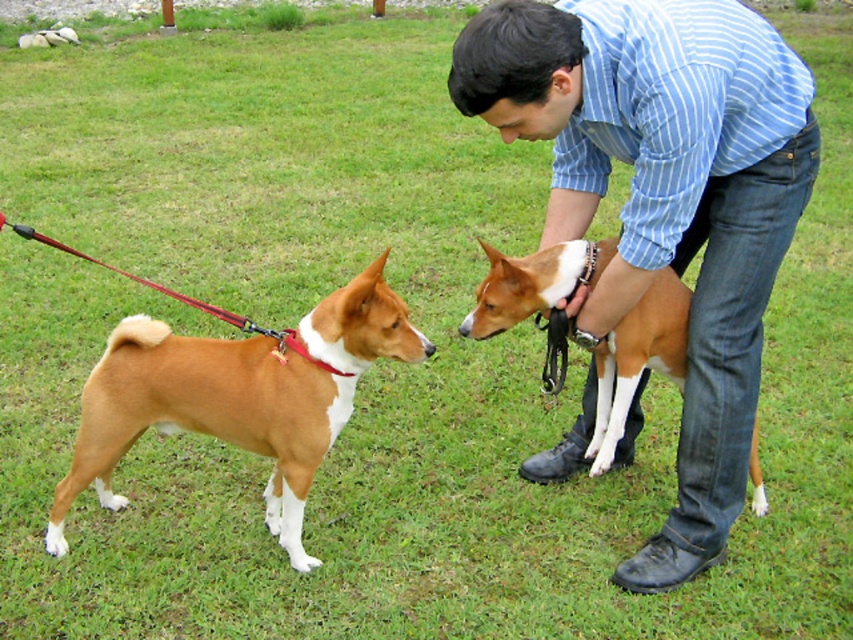
You are a photographer standing at the edge of the grassy field. You want to take a photo of the blue striped shirt at upper center and ensure that both the man and the two dogs are in focus. Based on the distance between the shirt and the dogs, will you need to adjust your camera settings for depth of field?

The blue striped shirt at upper center and the dogs are 6.89 feet apart. To ensure both the shirt and the dogs are in focus, you may need to adjust your camera settings for a larger depth of field to cover the distance between them.

You are a photographer trying to capture a photo of the two brown smooth dogs. Since you want to focus on the dog at the center, should you position yourself closer to the brown smooth dog at left or the brown smooth dog at center?

You should position yourself closer to the brown smooth dog at center because the brown smooth dog at left is in front of it, so moving closer to the center dog will help you focus on it without obstruction.